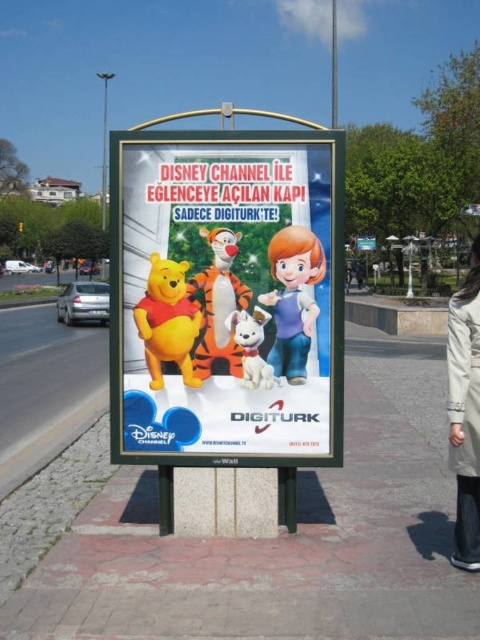
Question: Estimate the real-world distances between objects in this image. Which object is farther from the cobblestone pavement at center?

Choices:
 (A) yellow matte winnie the pooh at center
 (B) matte plastic poster at center
 (C) white plush dog at center
 (D) orange plush tiger at center

Answer: (D)

Question: Is light brown leather jacket at lower right to the right of orange plush tiger at center from the viewer's perspective?

Choices:
 (A) no
 (B) yes

Answer: (B)

Question: Is the position of matte plastic poster at center more distant than that of yellow matte winnie the pooh at center?

Choices:
 (A) yes
 (B) no

Answer: (B)

Question: Can you confirm if light brown leather jacket at lower right is positioned above metallic pole at center?

Choices:
 (A) yes
 (B) no

Answer: (B)

Question: Considering the real-world distances, which object is closest to the yellow matte winnie the pooh at center?

Choices:
 (A) white plush dog at center
 (B) metallic pole at center
 (C) light brown leather jacket at lower right

Answer: (A)

Question: Based on their relative distances, which object is nearer to the orange plush tiger at center?

Choices:
 (A) light brown leather jacket at lower right
 (B) yellow matte winnie the pooh at center

Answer: (B)